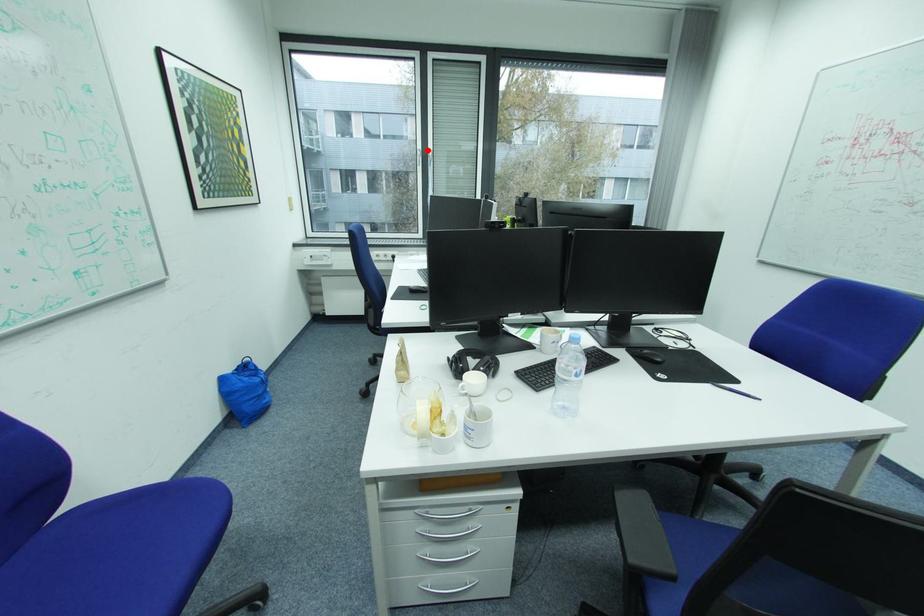
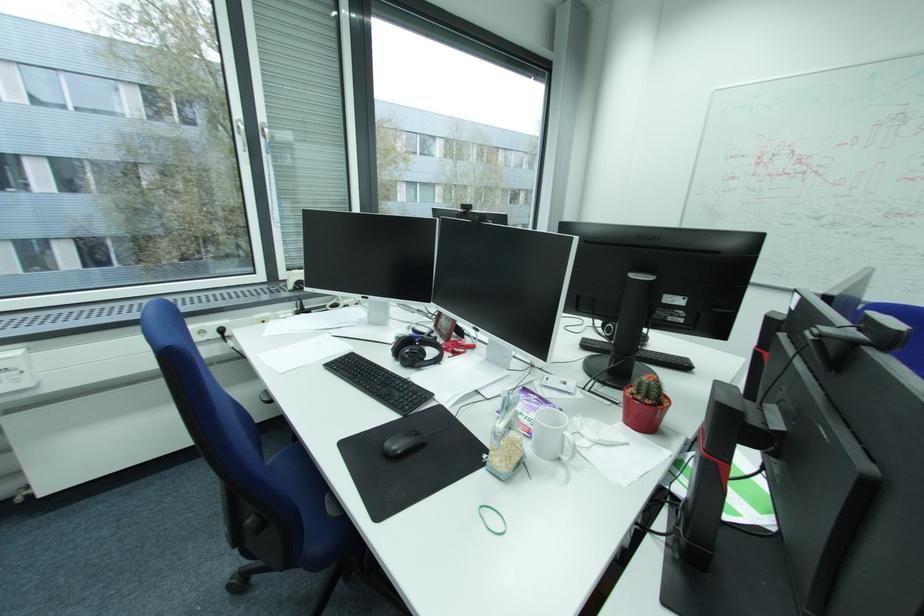
Question: I am providing you with two images of the same scene from different viewpoints. Given a red point in image1, look at the same physical point in image2. Is it:

Choices:
 (A) Closer to the viewpoint
 (B) Farther from the viewpoint

Answer: (B)